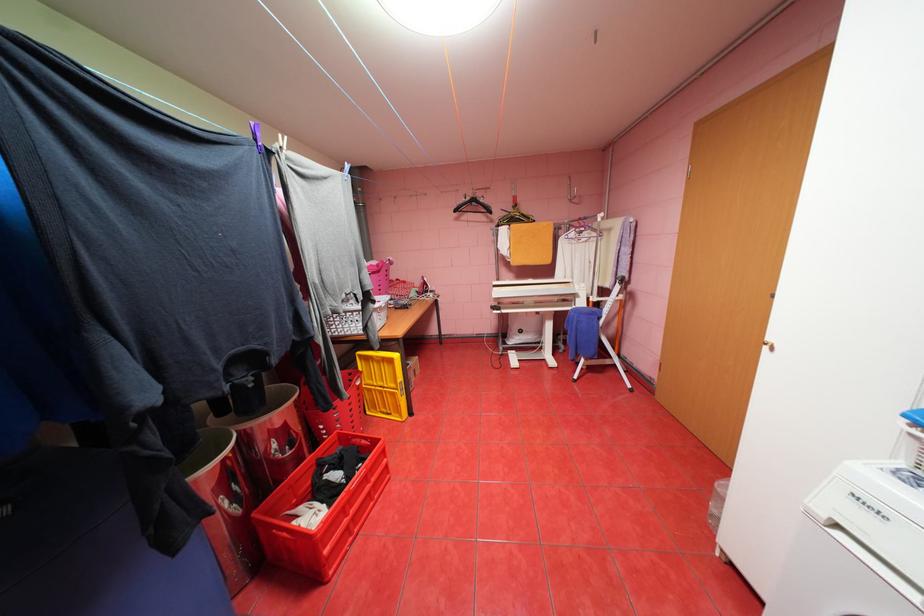
What do you see at coordinates (856, 546) in the screenshot? I see `a appliance top lid` at bounding box center [856, 546].